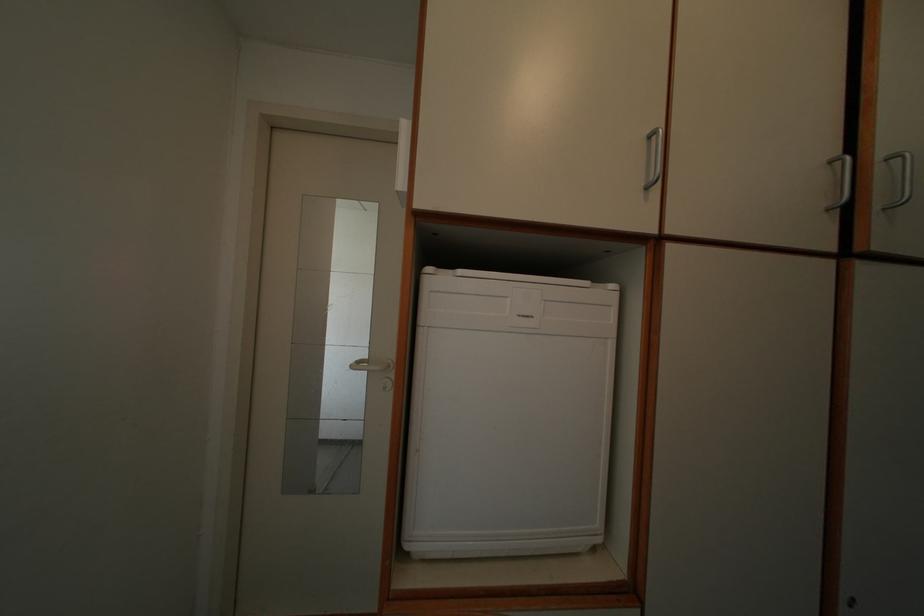
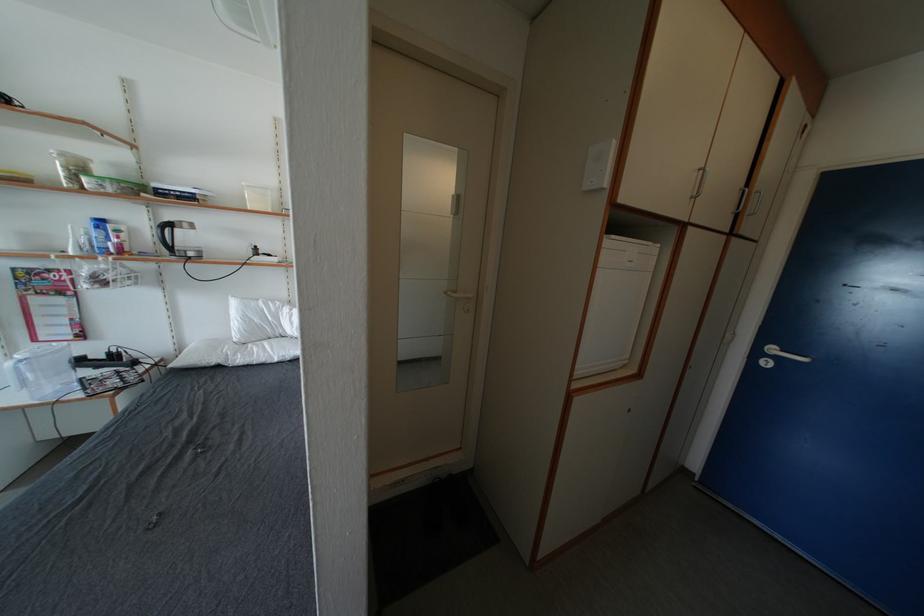
First-person continuous shooting, in which direction is the camera rotating?

The camera's rotation is toward right-down.